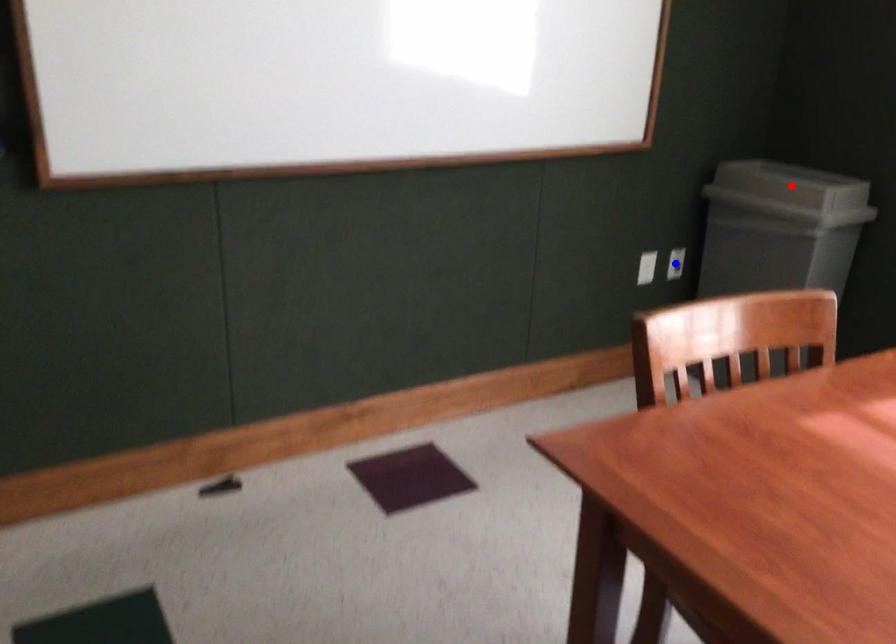
Question: Which of the two points in the image is closer to the camera?

Choices:
 (A) Blue point is closer.
 (B) Red point is closer.

Answer: (B)